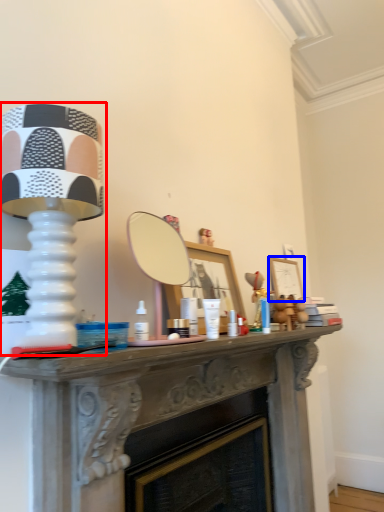
Question: Which point is further to the camera, table lamp (highlighted by a red box) or picture frame (highlighted by a blue box)?

Choices:
 (A) table lamp
 (B) picture frame

Answer: (B)